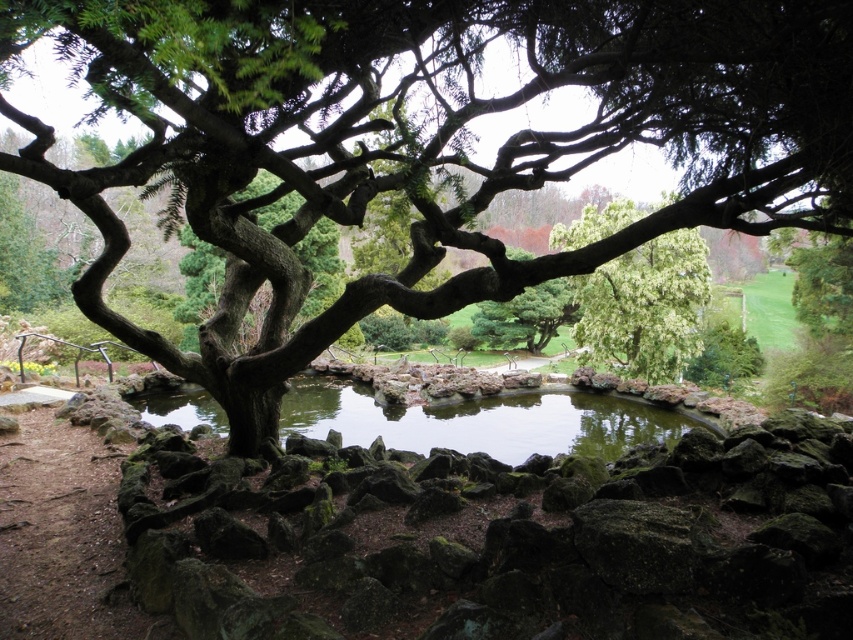
You are a bird flying over the garden. You see the clear water at center and the green leafy tree at center. Where would you land to rest?

The green leafy tree at center is above the clear water at center, so you can land on the green leafy tree at center to rest.

You are standing in the garden and want to take a photo of both the point at coordinates point (585, 141) and point (329, 419). Which point should you focus on first to ensure both are in sharp focus?

You should focus on point (585, 141) first because it is closer to the camera than point (329, 419). This ensures the foreground is in focus, and the background point will also be sharp due to depth of field.